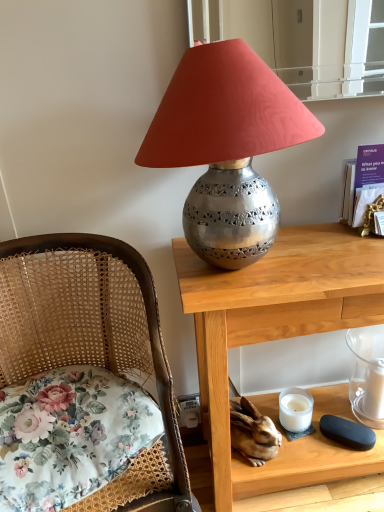
Identify the location of vacant space that is in between metallic silver lampshade at upper center and purple paper at upper right. (340, 251).